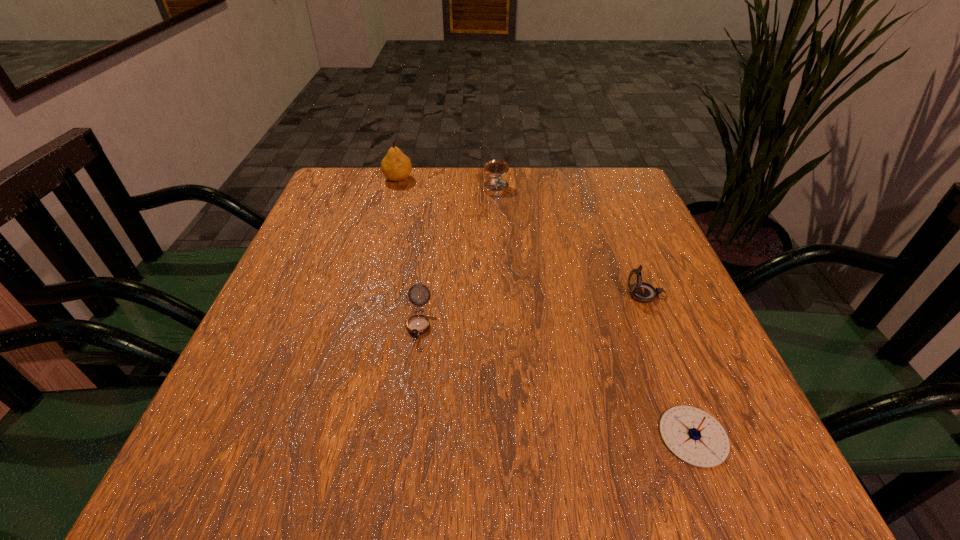
Identify the location of pear situated at the far edge. This screenshot has height=540, width=960. (396, 166).

The width and height of the screenshot is (960, 540). I want to click on compass situated at the far edge, so click(496, 187).

In order to click on object that is at the near edge in this screenshot , I will do `click(694, 436)`.

This screenshot has height=540, width=960. Find the location of `object that is at the left edge`. object that is at the left edge is located at coordinates (396, 166).

What are the coordinates of `object present at the far left corner` in the screenshot? It's located at (396, 166).

Find the location of a particular element. This screenshot has height=540, width=960. object that is at the near right corner is located at coordinates (694, 436).

In the image, there is a desktop. In order to click on free space at the far edge in this screenshot , I will do `click(537, 170)`.

Image resolution: width=960 pixels, height=540 pixels. I want to click on free space at the near edge of the desktop, so click(x=561, y=448).

You are a GUI agent. You are given a task and a screenshot of the screen. Output one action in this format:
    pyautogui.click(x=<x>, y=<y>)
    Task: Click on the free space at the left edge of the desktop
    This screenshot has height=540, width=960.
    Given the screenshot: What is the action you would take?
    pyautogui.click(x=310, y=329)

The image size is (960, 540). Find the location of `vacant area at the right edge`. vacant area at the right edge is located at coordinates (588, 216).